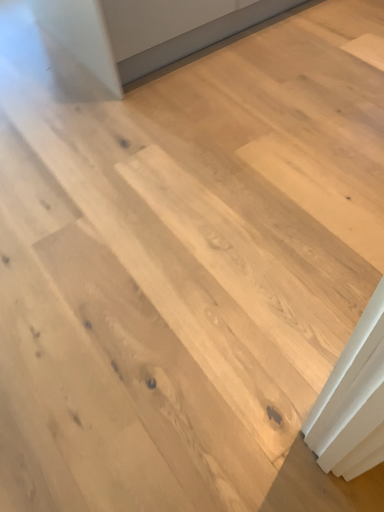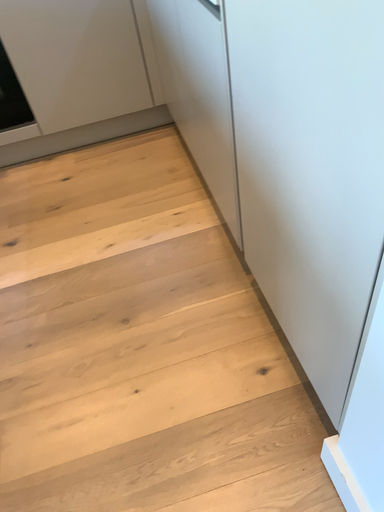
Question: How did the camera likely rotate when shooting the video?

Choices:
 (A) rotated downward
 (B) rotated upward

Answer: (B)